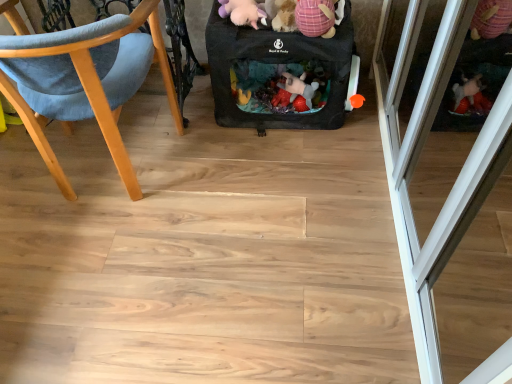
This screenshot has width=512, height=384. What are the coordinates of `free space in front of wooden chair at left` in the screenshot? It's located at (103, 269).